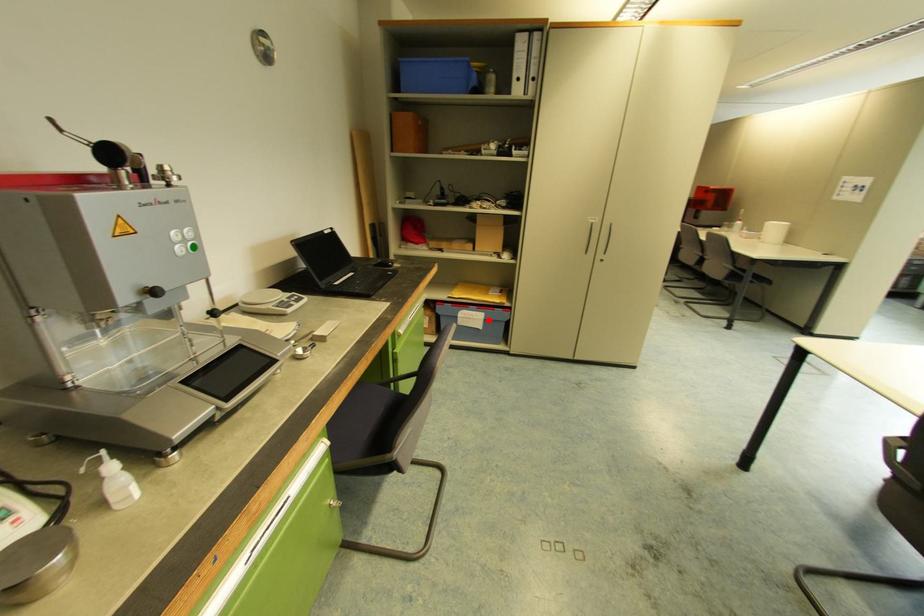
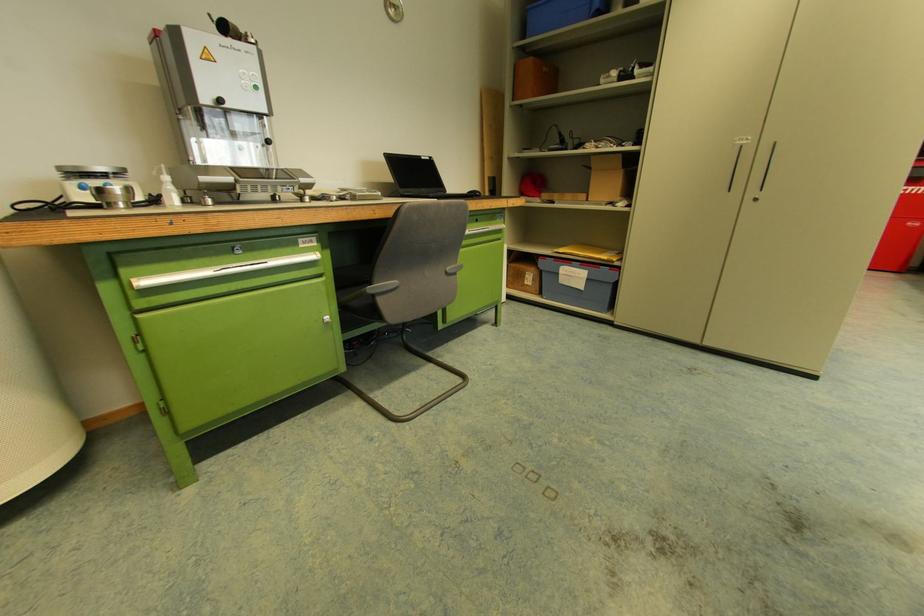
Question: A red point is marked in image1. In image2, is the corresponding 3D point closer to the camera or farther? Reply with the corresponding letter.

Choices:
 (A) The corresponding 3D point is closer.
 (B) The corresponding 3D point is farther.

Answer: (A)